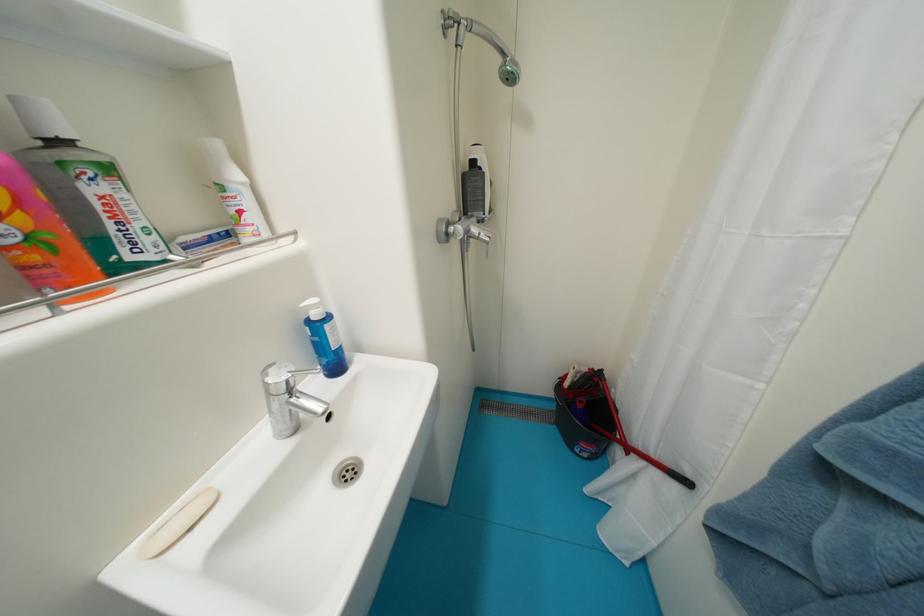
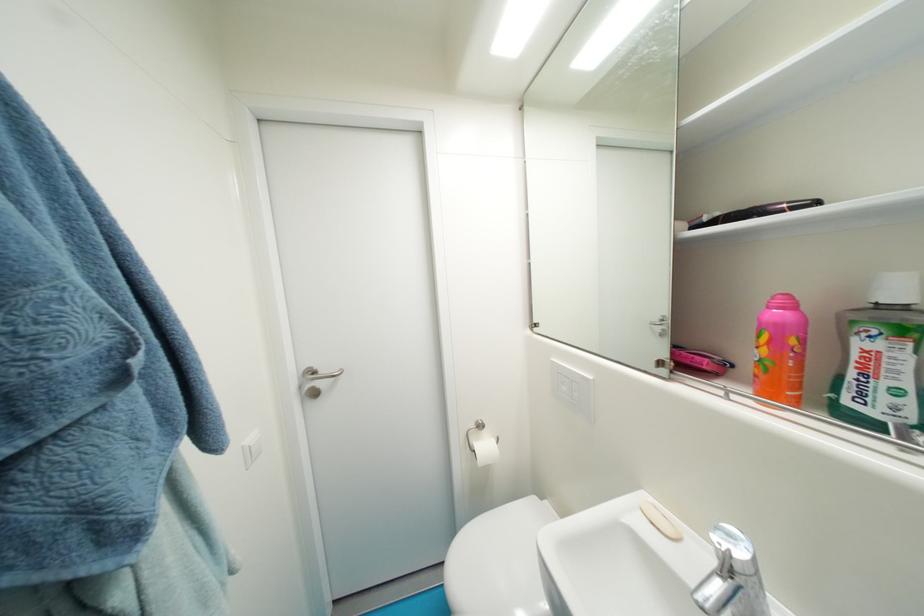
Find the pixel in the second image that matches the point at 53,238 in the first image.

(774, 363)